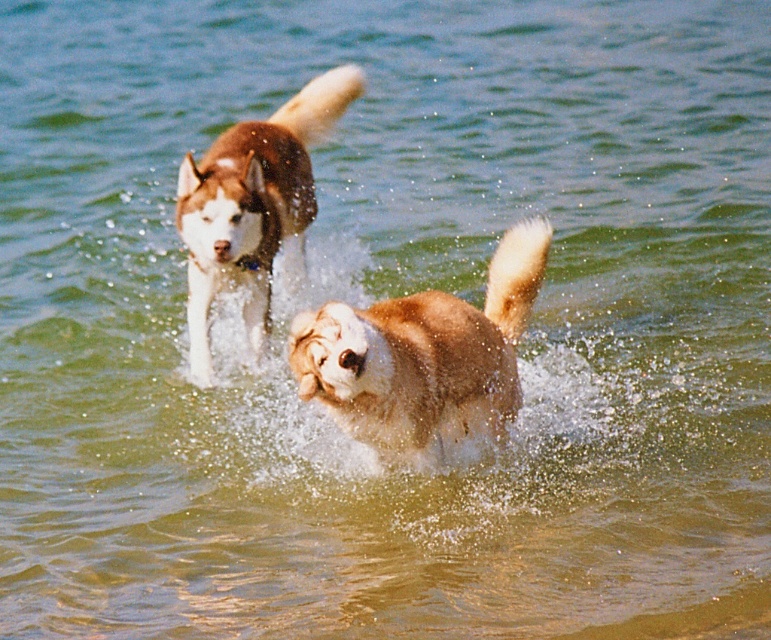
You are a photographer trying to capture both the fuzzy brown dog at center and the brown fur dog at center in a single shot. Based on their positions and sizes, which dog should you focus on first to ensure both are fully in frame?

The fuzzy brown dog at center might be wider than brown fur dog at center, so you should focus on the fuzzy brown dog at center first to accommodate its larger size within the frame.

You are a photographer trying to capture the perfect shot of the dogs playing in the water. You want to ensure that the fuzzy brown dog at center is in focus. Given that your camera can only focus on objects within a 0.5 unit radius around the point you select, would focusing at point (423, 355) ensure the fuzzy brown dog at center is in focus?

Yes, focusing at point (423, 355) would ensure the fuzzy brown dog at center is in focus because the point is exactly where the dog is located.